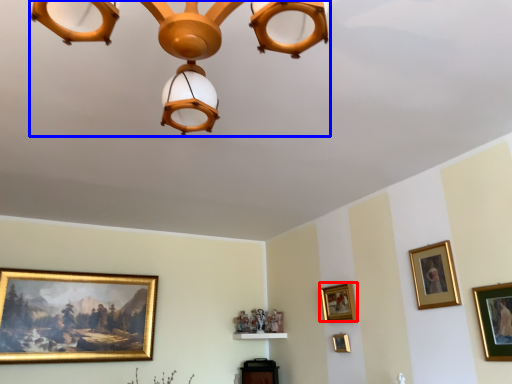
Question: Among these objects, which one is farthest to the camera, picture frame (highlighted by a red box) or lamp (highlighted by a blue box)?

Choices:
 (A) picture frame
 (B) lamp

Answer: (A)